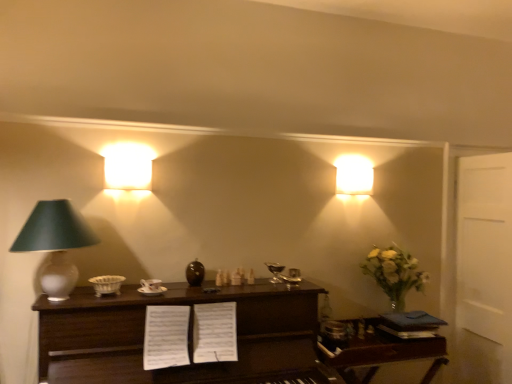
Question: From the image's perspective, does dark wood table at center, positioned as the 1th table in left-to-right order, appear higher than wooden table at right, the 2th table viewed from the left?

Choices:
 (A) no
 (B) yes

Answer: (B)

Question: Is the depth of dark wood table at center, positioned as the 1th table in left-to-right order, greater than that of wooden table at right, the 2th table viewed from the left?

Choices:
 (A) yes
 (B) no

Answer: (B)

Question: Does dark wood table at center, positioned as the 1th table in left-to-right order, contain wooden table at right, which is the 1th table in right-to-left order?

Choices:
 (A) no
 (B) yes

Answer: (A)

Question: From a real-world perspective, is dark wood table at center, positioned as the 1th table in left-to-right order, located beneath wooden table at right, the 2th table viewed from the left?

Choices:
 (A) no
 (B) yes

Answer: (A)

Question: Considering the relative sizes of dark wood table at center, positioned as the second table in right-to-left order, and wooden table at right, which is the 1th table in right-to-left order, in the image provided, is dark wood table at center, positioned as the second table in right-to-left order, wider than wooden table at right, which is the 1th table in right-to-left order,?

Choices:
 (A) yes
 (B) no

Answer: (A)

Question: From a real-world perspective, does dark wood table at center, positioned as the 1th table in left-to-right order, stand above wooden table at right, the 2th table viewed from the left?

Choices:
 (A) yes
 (B) no

Answer: (A)

Question: Is matte white lamp at left, the 3th lamp in the right-to-left sequence, next to matte white lampshade at upper left, the 2th lamp from the left, and touching it?

Choices:
 (A) no
 (B) yes

Answer: (A)

Question: Can you confirm if matte white lamp at left, the 3th lamp in the right-to-left sequence, is shorter than matte white lampshade at upper left, the 2th lamp from the left?

Choices:
 (A) no
 (B) yes

Answer: (A)

Question: From a real-world perspective, is matte white lamp at left, which ranks as the 1th lamp in left-to-right order, beneath matte white lampshade at upper left, marked as the second lamp in a front-to-back arrangement?

Choices:
 (A) no
 (B) yes

Answer: (B)

Question: Does matte white lamp at left, the 3th lamp in the right-to-left sequence, appear on the left side of matte white lampshade at upper left, which ranks as the 2th lamp in right-to-left order?

Choices:
 (A) yes
 (B) no

Answer: (A)

Question: Considering the relative positions of matte white lamp at left, placed as the 3th lamp when sorted from back to front, and matte white lampshade at upper left, which ranks as the 2th lamp in right-to-left order, in the image provided, is matte white lamp at left, placed as the 3th lamp when sorted from back to front, to the right of matte white lampshade at upper left, which ranks as the 2th lamp in right-to-left order, from the viewer's perspective?

Choices:
 (A) yes
 (B) no

Answer: (B)

Question: From the image's perspective, is matte white lamp at left, placed as the 3th lamp when sorted from back to front, located beneath matte white lampshade at upper left, the second lamp from the back?

Choices:
 (A) no
 (B) yes

Answer: (B)

Question: Does dark wood table at center, positioned as the second table in right-to-left order, lie in front of matte white lampshade at upper left, marked as the second lamp in a front-to-back arrangement?

Choices:
 (A) yes
 (B) no

Answer: (A)